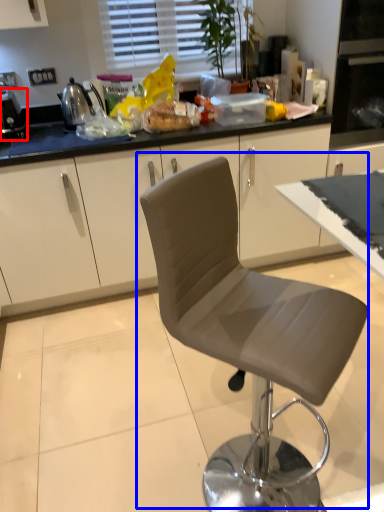
Question: Which of the following is the closest to the observer, appliance (highlighted by a red box) or chair (highlighted by a blue box)?

Choices:
 (A) appliance
 (B) chair

Answer: (B)